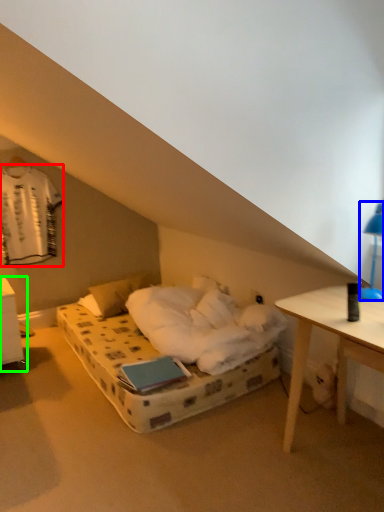
Question: Which object is the farthest from laundry (highlighted by a red box)? Choose among these: bedside lamp (highlighted by a blue box) or nightstand (highlighted by a green box).

Choices:
 (A) bedside lamp
 (B) nightstand

Answer: (A)